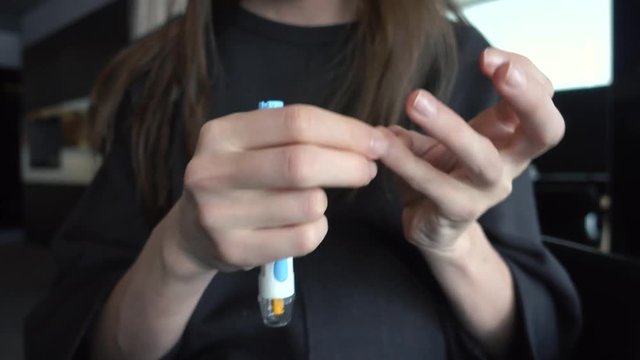
This screenshot has width=640, height=360. In order to click on window in this screenshot , I will do `click(548, 19)`.